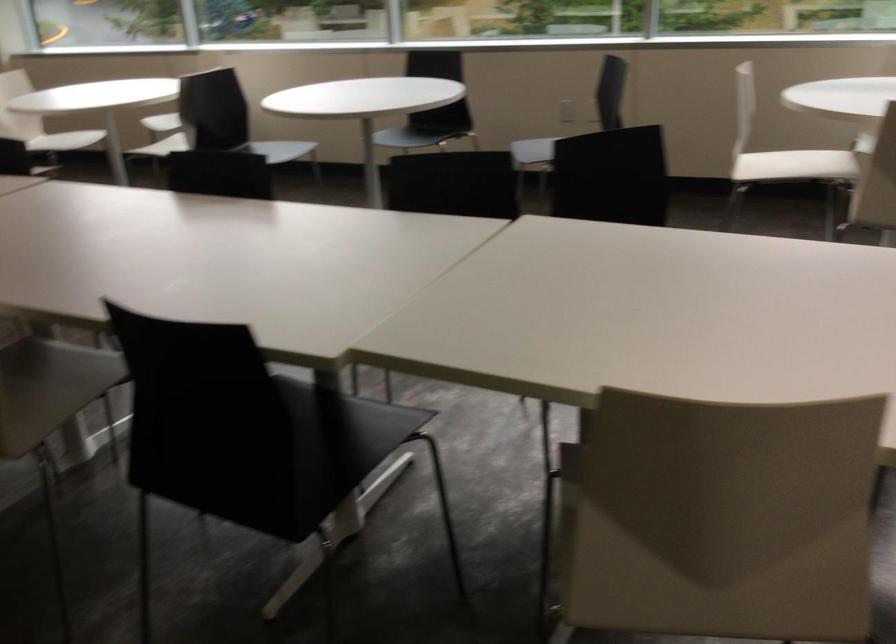
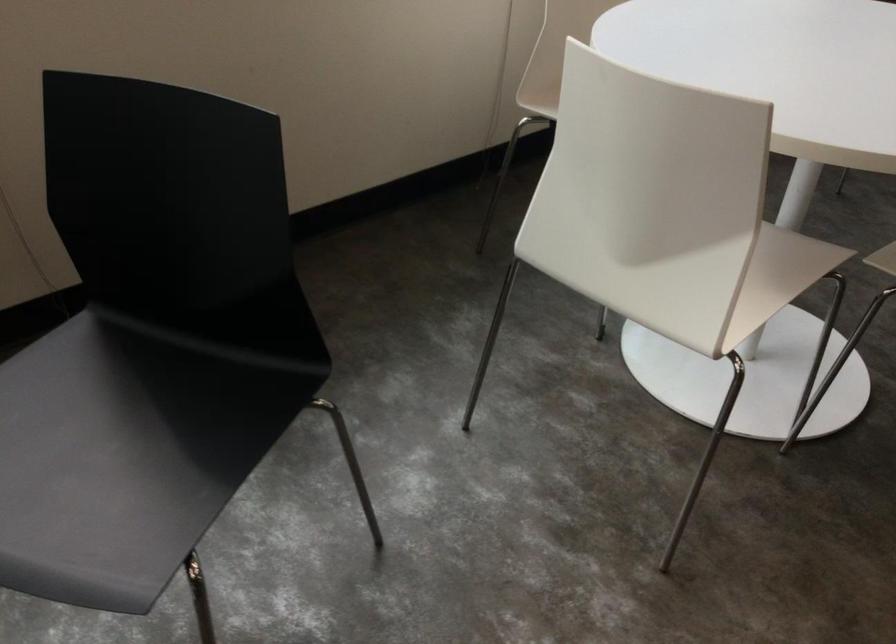
In the second image, find the point that corresponds to point 814,166 in the first image.

(777, 277)